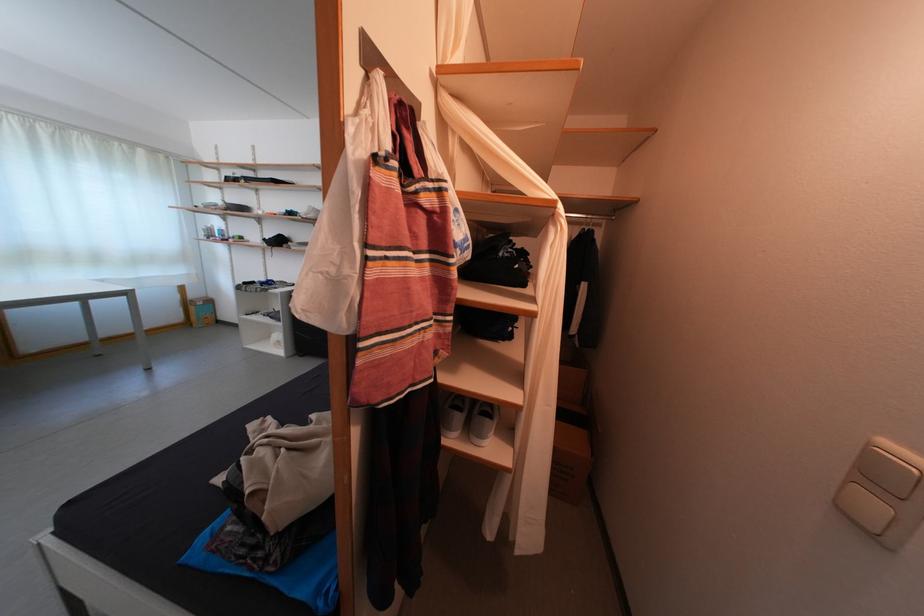
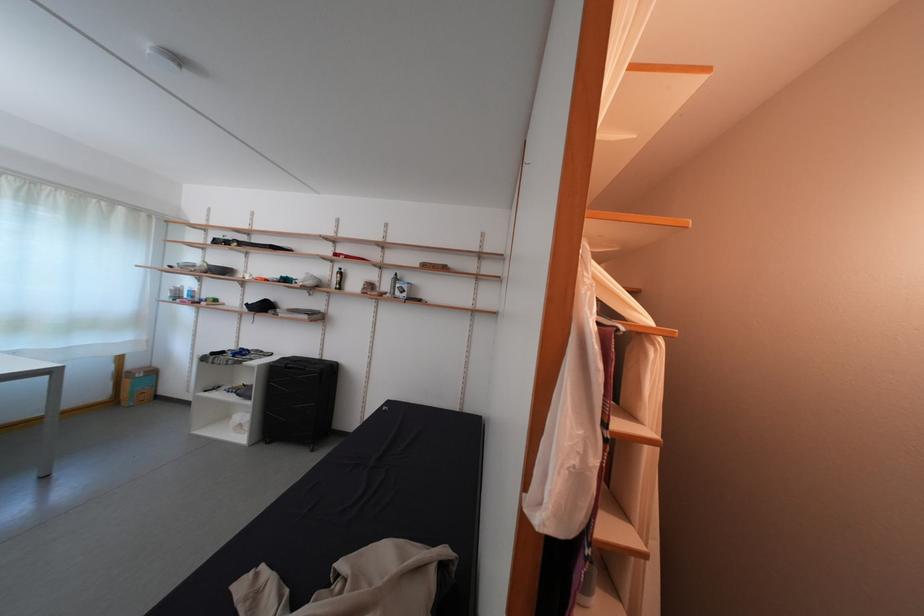
Question: In a continuous first-person perspective shot, in which direction is the camera moving?

Choices:
 (A) Left
 (B) Right
 (C) Forward
 (D) Backward

Answer: (A)